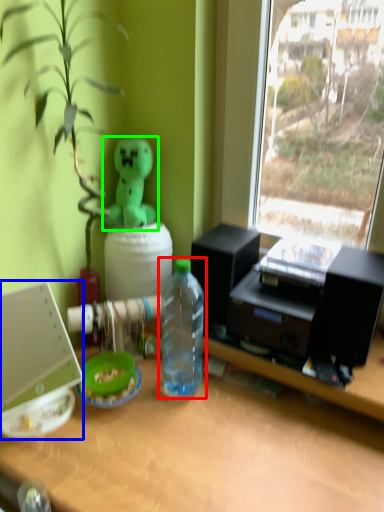
Question: Which object is the farthest from bottle (highlighted by a red box)? Choose among these: laptop (highlighted by a blue box) or toy (highlighted by a green box).

Choices:
 (A) laptop
 (B) toy

Answer: (A)